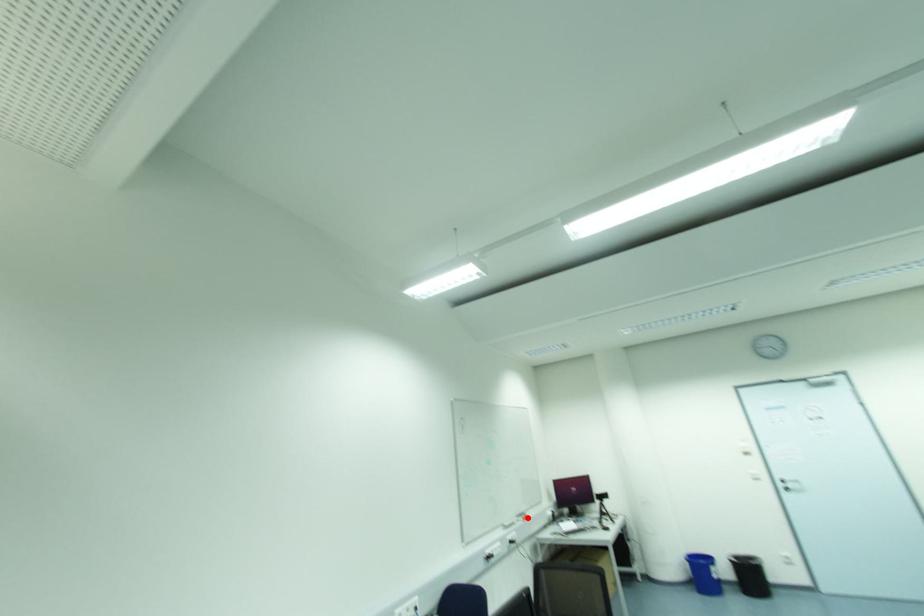
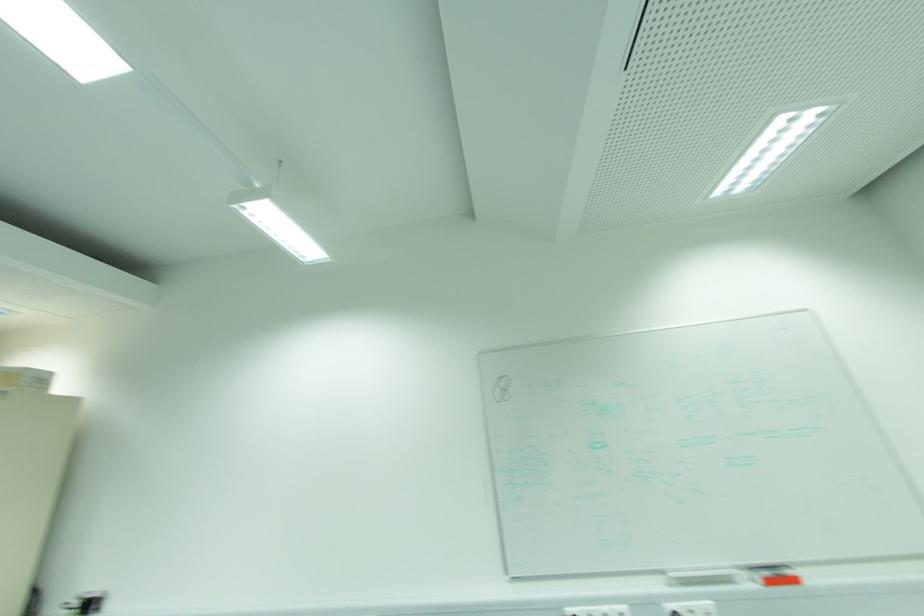
The point at the highlighted location is marked in the first image. Where is the corresponding point in the second image?

(796, 581)